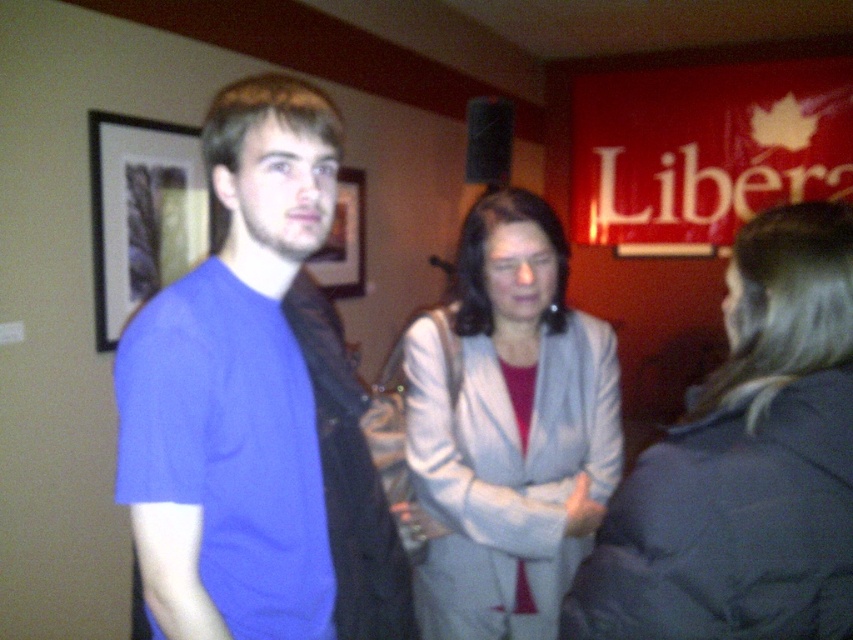
Consider the image. You are at a social event and want to take a photo of the black framed picture at left without including the light gray fabric jacket at center in the frame. Is this possible based on their positions?

The light gray fabric jacket at center is positioned on the right side of the black framed picture at left, so you can take a photo of the black framed picture at left by angling the camera to exclude the light gray fabric jacket at center since it is to the right of the picture.

You are a photographer trying to capture a group photo of the light gray fabric coat at center and the dark jacket on the right. The minimum distance required for your camera to focus properly is 70 centimeters. Based on the scene description, will the camera be able to focus on both subjects simultaneously?

The light gray fabric coat at center and the dark jacket on the right are 75.59 centimeters apart, which exceeds the minimum 70 centimeter requirement. Therefore, the camera should be able to focus on both subjects simultaneously.